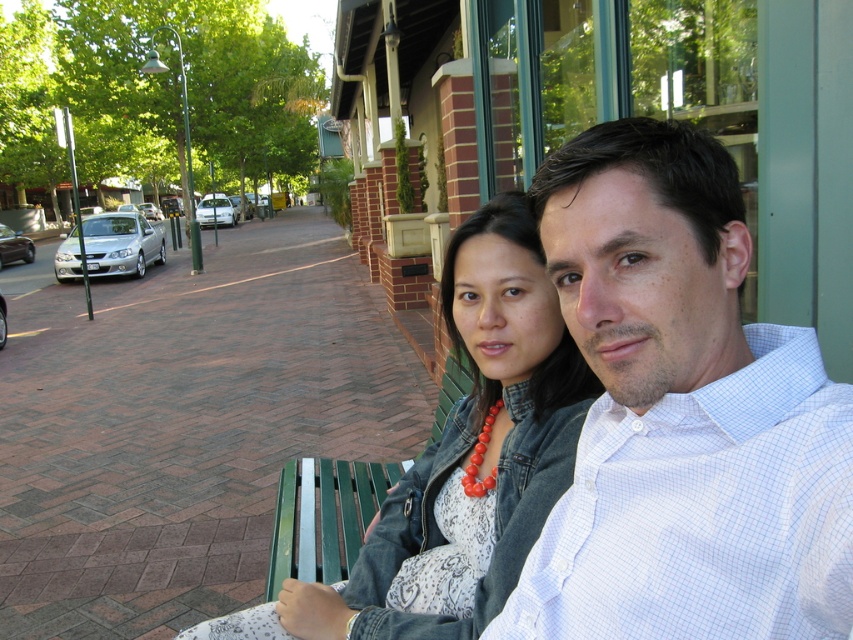
You are a photographer standing in front of the two people on the bench. You want to take a photo focusing on the white checkered shirt at center and the denim jacket at center. Which one should you adjust your camera focus to first to ensure both are in clear view?

The white checkered shirt at center is closer to the viewer than the denim jacket at center, so you should focus on the white checkered shirt at center first to ensure both are in clear view.

You are a photographer standing 2 feet away from the camera. You want to take a portrait of the person wearing the white checkered shirt at center. Can you step forward enough to focus on them without moving the subject?

The white checkered shirt at center is 23.20 inches away from camera. Since you are standing 2 feet away from the camera, which is 24 inches, you have 0.8 inches of space to move forward. This is not enough to focus properly, so you should ask the subject to move closer or adjust your position further back.

You are standing in front of the scene and want to reach a point that is exactly 80.67 centimeters away from the camera. Can you confirm if the point at coordinates point (688,433) is the correct location?

The point at coordinates point (688,433) is exactly 80.67 centimeters away from the camera, so yes, it is the correct location.